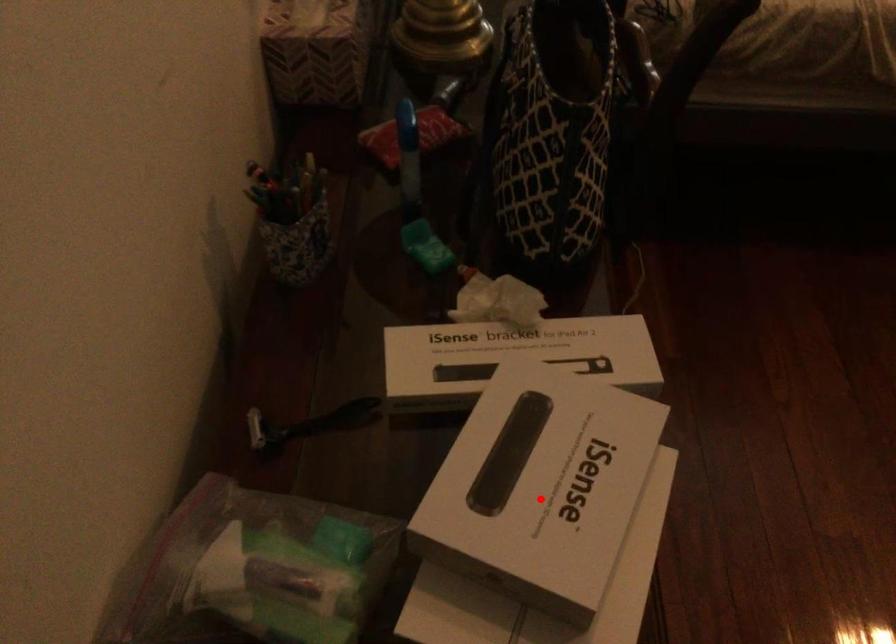
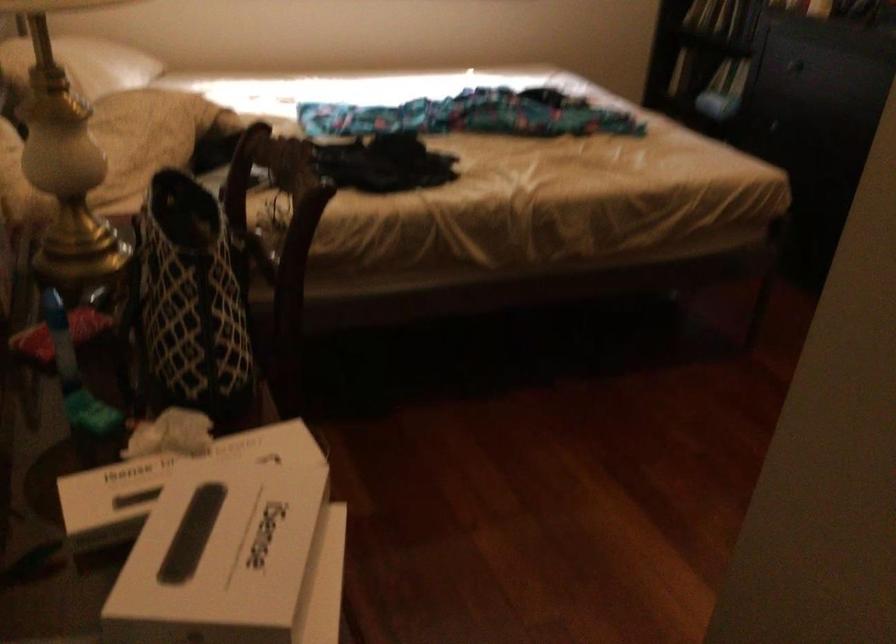
Find the pixel in the second image that matches the highlighted location in the first image.

(234, 560)